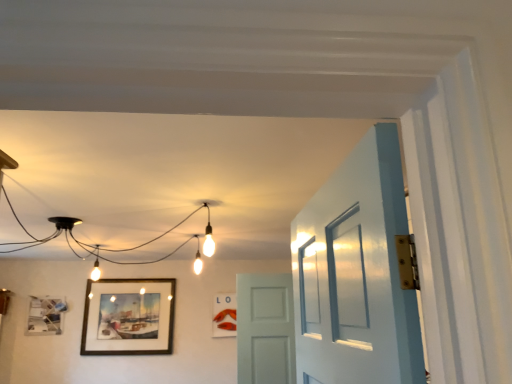
Locate an element on the screen. The height and width of the screenshot is (384, 512). matte wooden picture frame at center, the first picture frame when ordered from right to left is located at coordinates (224, 315).

This screenshot has width=512, height=384. What are the coordinates of `wooden framed painting at lower left, which is counted as the second picture frame, starting from the right` in the screenshot? It's located at (128, 317).

You are a GUI agent. You are given a task and a screenshot of the screen. Output one action in this format:
    pyautogui.click(x=<x>, y=<y>)
    Task: Click on the white matte door at center
    This screenshot has width=512, height=384.
    Given the screenshot: What is the action you would take?
    pyautogui.click(x=265, y=329)

Image resolution: width=512 pixels, height=384 pixels. Identify the location of matte wooden picture frame at center, which ranks as the 3th picture frame in left-to-right order. (224, 315).

Is matte wooden picture frame at center, which ranks as the 3th picture frame in left-to-right order, positioned with its back to wooden framed painting at lower left, acting as the second picture frame starting from the left?

matte wooden picture frame at center, which ranks as the 3th picture frame in left-to-right order, is not turned away from wooden framed painting at lower left, acting as the second picture frame starting from the left.

From a real-world perspective, who is located lower, matte wooden picture frame at center, which ranks as the 3th picture frame in left-to-right order, or wooden framed painting at lower left, which is counted as the second picture frame, starting from the right?

From a 3D spatial view, matte wooden picture frame at center, which ranks as the 3th picture frame in left-to-right order, is below.

What's the angular difference between matte wooden picture frame at center, which ranks as the 3th picture frame in left-to-right order, and wooden framed painting at lower left, which is counted as the second picture frame, starting from the right,'s facing directions?

1.45 degrees.

Between point (231, 335) and point (129, 354), which one is positioned in front?

Positioned in front is point (129, 354).

Looking at this image, considering the positions of objects wooden framed painting at lower left, acting as the second picture frame starting from the left, and matte black picture frame at upper left, the third picture frame in the right-to-left sequence, in the image provided, who is more to the left, wooden framed painting at lower left, acting as the second picture frame starting from the left, or matte black picture frame at upper left, the third picture frame in the right-to-left sequence,?

From the viewer's perspective, matte black picture frame at upper left, the third picture frame in the right-to-left sequence, appears more on the left side.

Is wooden framed painting at lower left, which is counted as the second picture frame, starting from the right, looking in the opposite direction of matte black picture frame at upper left, the third picture frame in the right-to-left sequence?

No, matte black picture frame at upper left, the third picture frame in the right-to-left sequence, is not at the back of wooden framed painting at lower left, which is counted as the second picture frame, starting from the right.

Is wooden framed painting at lower left, which is counted as the second picture frame, starting from the right, wider than matte black picture frame at upper left, the third picture frame in the right-to-left sequence?

Incorrect, the width of wooden framed painting at lower left, which is counted as the second picture frame, starting from the right, does not surpass that of matte black picture frame at upper left, the third picture frame in the right-to-left sequence.

Considering the positions of points (109, 353) and (56, 302), is point (109, 353) closer to camera compared to point (56, 302)?

Yes, point (109, 353) is closer to viewer.

Which is in front, point (37, 322) or point (289, 381)?

The point (289, 381) is in front.

Looking at this image, is matte black picture frame at upper left, placed as the first picture frame when sorted from left to right, not inside white matte door at center?

Yes, matte black picture frame at upper left, placed as the first picture frame when sorted from left to right, is not within white matte door at center.

Which of these two, matte black picture frame at upper left, the third picture frame in the right-to-left sequence, or white matte door at center, is wider?

white matte door at center is wider.

Is matte black picture frame at upper left, the third picture frame in the right-to-left sequence, touching white matte door at center?

They are not placed beside each other.

Does point (159, 347) come farther from viewer compared to point (228, 336)?

No, (159, 347) is in front of (228, 336).

Based on the photo, is wooden framed painting at lower left, acting as the second picture frame starting from the left, in contact with matte wooden picture frame at center, the first picture frame when ordered from right to left?

wooden framed painting at lower left, acting as the second picture frame starting from the left, is not next to matte wooden picture frame at center, the first picture frame when ordered from right to left, and they're not touching.

Is wooden framed painting at lower left, which is counted as the second picture frame, starting from the right, further to the viewer compared to matte wooden picture frame at center, the first picture frame when ordered from right to left?

No, it is in front of matte wooden picture frame at center, the first picture frame when ordered from right to left.

In terms of height, does wooden framed painting at lower left, acting as the second picture frame starting from the left, look taller or shorter compared to matte wooden picture frame at center, the first picture frame when ordered from right to left?

In the image, wooden framed painting at lower left, acting as the second picture frame starting from the left, appears to be taller than matte wooden picture frame at center, the first picture frame when ordered from right to left.

How far apart are matte black picture frame at upper left, the third picture frame in the right-to-left sequence, and matte wooden picture frame at center, which ranks as the 3th picture frame in left-to-right order?

matte black picture frame at upper left, the third picture frame in the right-to-left sequence, is 2.05 meters away from matte wooden picture frame at center, which ranks as the 3th picture frame in left-to-right order.

Does matte black picture frame at upper left, placed as the first picture frame when sorted from left to right, have a lesser height compared to matte wooden picture frame at center, which ranks as the 3th picture frame in left-to-right order?

Indeed, matte black picture frame at upper left, placed as the first picture frame when sorted from left to right, has a lesser height compared to matte wooden picture frame at center, which ranks as the 3th picture frame in left-to-right order.

Which picture frame is the 2nd one when counting from the right side of the matte black picture frame at upper left, placed as the first picture frame when sorted from left to right? Please provide its 2D coordinates.

[(224, 315)]

Considering the relative positions of matte black picture frame at upper left, the third picture frame in the right-to-left sequence, and matte wooden picture frame at center, which ranks as the 3th picture frame in left-to-right order, in the image provided, is matte black picture frame at upper left, the third picture frame in the right-to-left sequence, to the left or to the right of matte wooden picture frame at center, which ranks as the 3th picture frame in left-to-right order,?

Based on their positions, matte black picture frame at upper left, the third picture frame in the right-to-left sequence, is located to the left of matte wooden picture frame at center, which ranks as the 3th picture frame in left-to-right order.

Does point (291, 318) appear closer or farther from the camera than point (27, 331)?

Point (291, 318) is closer to the camera than point (27, 331).

Is white matte door at center bigger than matte black picture frame at upper left, the third picture frame in the right-to-left sequence?

Indeed, white matte door at center has a larger size compared to matte black picture frame at upper left, the third picture frame in the right-to-left sequence.

What's the angular difference between white matte door at center and matte black picture frame at upper left, the third picture frame in the right-to-left sequence,'s facing directions?

2.77 degrees separate the facing orientations of white matte door at center and matte black picture frame at upper left, the third picture frame in the right-to-left sequence.

Does white matte door at center have a greater width compared to matte black picture frame at upper left, the third picture frame in the right-to-left sequence?

Indeed, white matte door at center has a greater width compared to matte black picture frame at upper left, the third picture frame in the right-to-left sequence.

Which is correct: matte wooden picture frame at center, the first picture frame when ordered from right to left, is inside matte black picture frame at upper left, placed as the first picture frame when sorted from left to right, or outside of it?

matte wooden picture frame at center, the first picture frame when ordered from right to left, is not inside matte black picture frame at upper left, placed as the first picture frame when sorted from left to right, it's outside.

Is point (220, 295) closer to camera compared to point (46, 324)?

Yes, it is in front of point (46, 324).

Does matte wooden picture frame at center, the first picture frame when ordered from right to left, lie behind matte black picture frame at upper left, placed as the first picture frame when sorted from left to right?

That is True.

Who is bigger, matte wooden picture frame at center, the first picture frame when ordered from right to left, or matte black picture frame at upper left, placed as the first picture frame when sorted from left to right?

With larger size is matte black picture frame at upper left, placed as the first picture frame when sorted from left to right.

The height and width of the screenshot is (384, 512). Identify the location of picture frame located behind the wooden framed painting at lower left, acting as the second picture frame starting from the left. (224, 315).

Identify the location of the 1st picture frame to the right of the matte black picture frame at upper left, the third picture frame in the right-to-left sequence, counting from the anchor's position. (128, 317).

Considering their positions, is white matte door at center positioned closer to wooden framed painting at lower left, acting as the second picture frame starting from the left, than matte black picture frame at upper left, placed as the first picture frame when sorted from left to right?

Among the two, matte black picture frame at upper left, placed as the first picture frame when sorted from left to right, is located nearer to wooden framed painting at lower left, acting as the second picture frame starting from the left.

When comparing their distances from matte wooden picture frame at center, the first picture frame when ordered from right to left, does matte black picture frame at upper left, the third picture frame in the right-to-left sequence, or white matte door at center seem closer?

white matte door at center.

Looking at the image, which one is located further to white matte door at center, matte wooden picture frame at center, which ranks as the 3th picture frame in left-to-right order, or matte black picture frame at upper left, placed as the first picture frame when sorted from left to right?

Answer: matte black picture frame at upper left, placed as the first picture frame when sorted from left to right.

From the image, which object appears to be farther from matte wooden picture frame at center, which ranks as the 3th picture frame in left-to-right order, wooden framed painting at lower left, which is counted as the second picture frame, starting from the right, or white matte door at center?

white matte door at center is positioned further to the anchor matte wooden picture frame at center, which ranks as the 3th picture frame in left-to-right order.

When comparing their distances from matte black picture frame at upper left, placed as the first picture frame when sorted from left to right, does matte wooden picture frame at center, which ranks as the 3th picture frame in left-to-right order, or wooden framed painting at lower left, acting as the second picture frame starting from the left, seem closer?

wooden framed painting at lower left, acting as the second picture frame starting from the left.

From the image, which object appears to be nearer to matte wooden picture frame at center, which ranks as the 3th picture frame in left-to-right order, wooden framed painting at lower left, which is counted as the second picture frame, starting from the right, or matte black picture frame at upper left, placed as the first picture frame when sorted from left to right?

Based on the image, wooden framed painting at lower left, which is counted as the second picture frame, starting from the right, appears to be nearer to matte wooden picture frame at center, which ranks as the 3th picture frame in left-to-right order.

Estimate the real-world distances between objects in this image. Which object is closer to matte black picture frame at upper left, placed as the first picture frame when sorted from left to right, matte wooden picture frame at center, the first picture frame when ordered from right to left, or white matte door at center?

Based on the image, matte wooden picture frame at center, the first picture frame when ordered from right to left, appears to be nearer to matte black picture frame at upper left, placed as the first picture frame when sorted from left to right.

Looking at the image, which one is located further to white matte door at center, matte black picture frame at upper left, the third picture frame in the right-to-left sequence, or wooden framed painting at lower left, acting as the second picture frame starting from the left?

matte black picture frame at upper left, the third picture frame in the right-to-left sequence.

Find the location of a particular element. picture frame located between matte black picture frame at upper left, placed as the first picture frame when sorted from left to right, and matte wooden picture frame at center, which ranks as the 3th picture frame in left-to-right order, in the left-right direction is located at coordinates (128, 317).